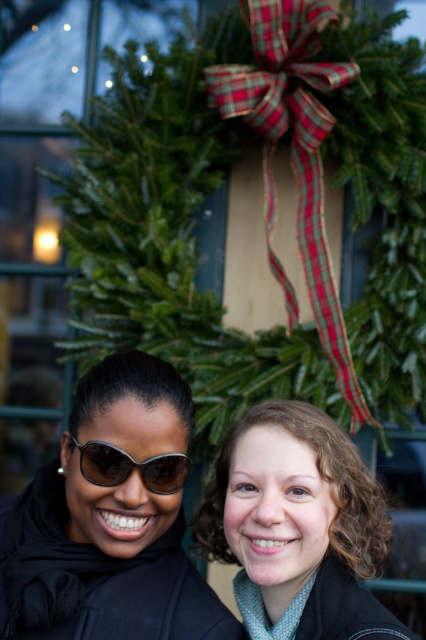
Question: From the image, what is the correct spatial relationship of curly brown hair at center in relation to sunglasses at center?

Choices:
 (A) below
 (B) above

Answer: (A)

Question: Among these objects, which one is farthest from the camera?

Choices:
 (A) curly brown hair at center
 (B) matte black sunglasses at center
 (C) sunglasses at center

Answer: (B)

Question: Can you confirm if matte black sunglasses at center is smaller than sunglasses at center?

Choices:
 (A) yes
 (B) no

Answer: (B)

Question: Is matte black sunglasses at center closer to camera compared to sunglasses at center?

Choices:
 (A) no
 (B) yes

Answer: (A)

Question: Estimate the real-world distances between objects in this image. Which object is closer to the matte black sunglasses at center?

Choices:
 (A) curly brown hair at center
 (B) sunglasses at center

Answer: (B)

Question: Which point is closer to the camera?

Choices:
 (A) (92, 474)
 (B) (135, 372)
 (C) (270, 532)

Answer: (C)